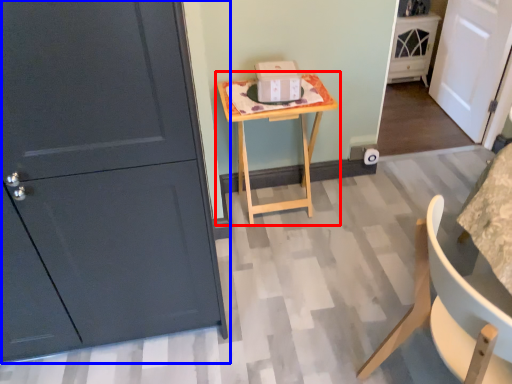
Question: Which object is closer to the camera taking this photo, table (highlighted by a red box) or door (highlighted by a blue box)?

Choices:
 (A) table
 (B) door

Answer: (B)